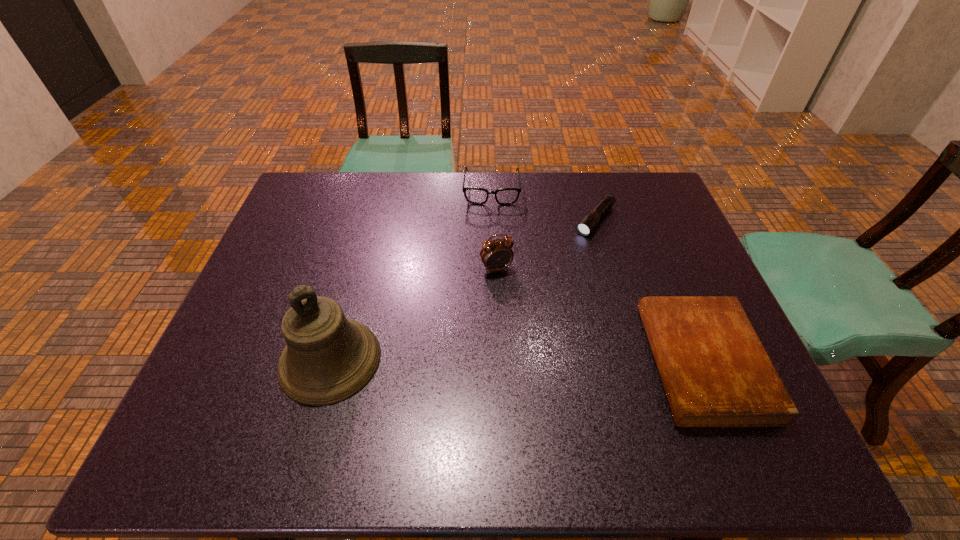
At what (x,y) coordinates should I click in order to perform the action: click on vacant space that is in between the flashlight and the third farthest object. Please return your answer as a coordinate pair (x, y). The height and width of the screenshot is (540, 960). Looking at the image, I should click on (545, 245).

At what (x,y) coordinates should I click in order to perform the action: click on vacant space that's between the Bible and the flashlight. Please return your answer as a coordinate pair (x, y). Image resolution: width=960 pixels, height=540 pixels. Looking at the image, I should click on (649, 292).

Locate an element on the screen. This screenshot has height=540, width=960. free space between the tallest object and the fourth shortest object is located at coordinates 414,314.

Find the location of a particular element. This screenshot has height=540, width=960. object that stands as the second closest to the bell is located at coordinates (504, 196).

Image resolution: width=960 pixels, height=540 pixels. Find the location of `object that is the fourth closest to the bell`. object that is the fourth closest to the bell is located at coordinates (715, 371).

At what (x,y) coordinates should I click in order to perform the action: click on vacant region that satisfies the following two spatial constraints: 1. on the front side of the flashlight; 2. on the right side of the spectacles. Please return your answer as a coordinate pair (x, y). The height and width of the screenshot is (540, 960). Looking at the image, I should click on (492, 220).

Identify the location of vacant region that satisfies the following two spatial constraints: 1. on the front side of the alarm clock; 2. on the right side of the third shortest object. (493, 269).

Find the location of a particular element. The image size is (960, 540). vacant space that satisfies the following two spatial constraints: 1. on the back side of the spectacles; 2. on the right side of the bell is located at coordinates (377, 190).

Find the location of a particular element. This screenshot has height=540, width=960. free space that satisfies the following two spatial constraints: 1. on the back side of the leftmost object; 2. on the right side of the spectacles is located at coordinates (377, 190).